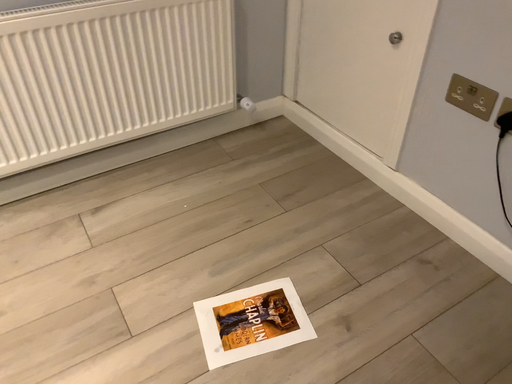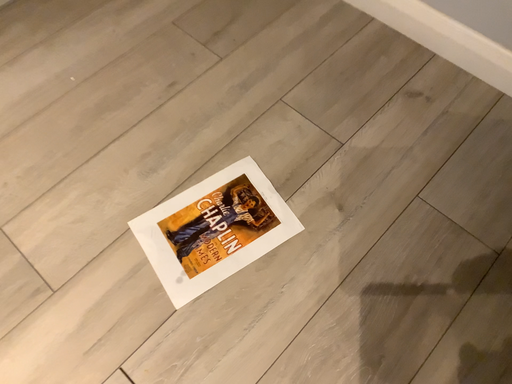
Question: Which way did the camera rotate in the video?

Choices:
 (A) rotated upward
 (B) rotated downward

Answer: (B)